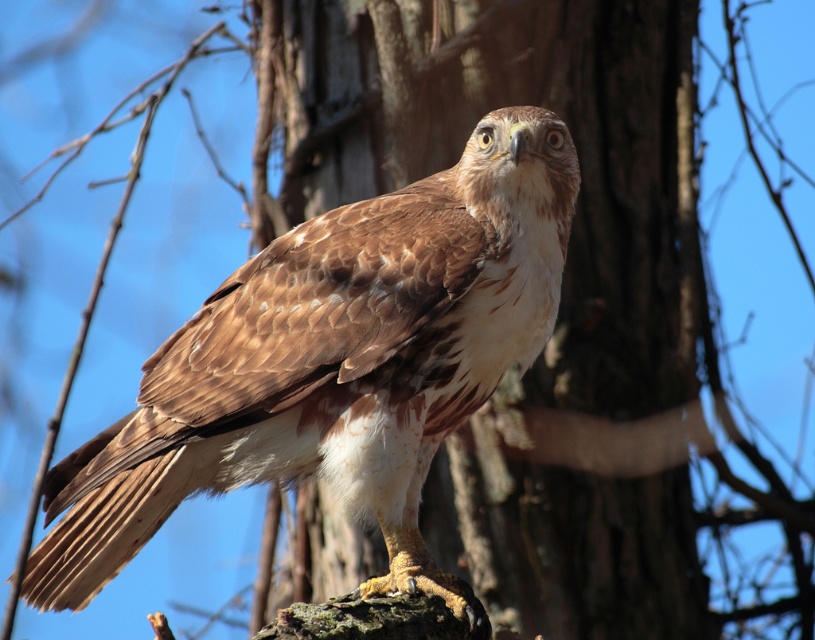
Question: Is brown rough bark at center to the left of brown feathered eagle at center from the viewer's perspective?

Choices:
 (A) yes
 (B) no

Answer: (B)

Question: Among these objects, which one is nearest to the camera?

Choices:
 (A) brown feathered eagle at center
 (B) brown rough bark at center

Answer: (A)

Question: Does brown rough bark at center appear on the left side of brown feathered eagle at center?

Choices:
 (A) yes
 (B) no

Answer: (B)

Question: Is brown rough bark at center below brown feathered eagle at center?

Choices:
 (A) no
 (B) yes

Answer: (A)

Question: Which object appears closest to the camera in this image?

Choices:
 (A) brown rough bark at center
 (B) brown feathered eagle at center

Answer: (B)